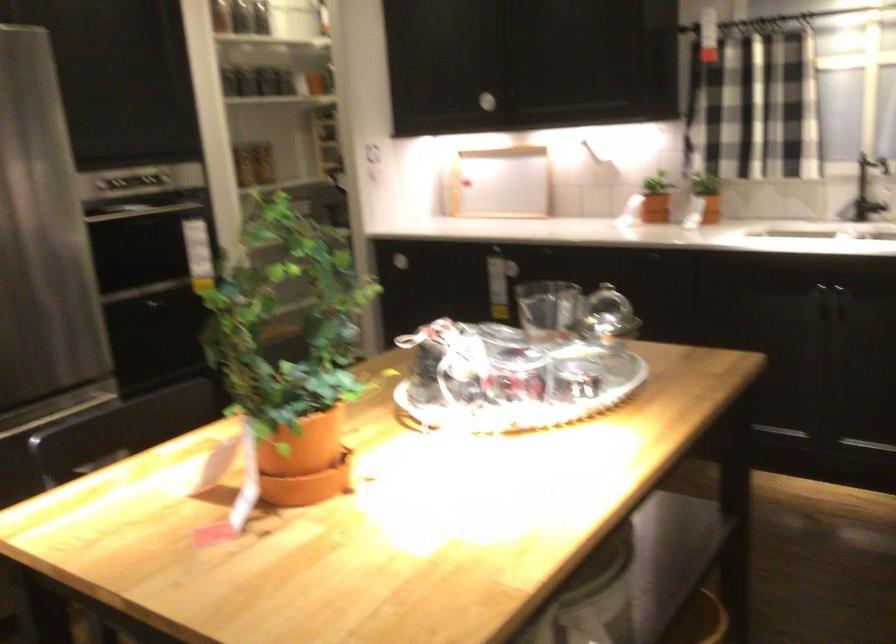
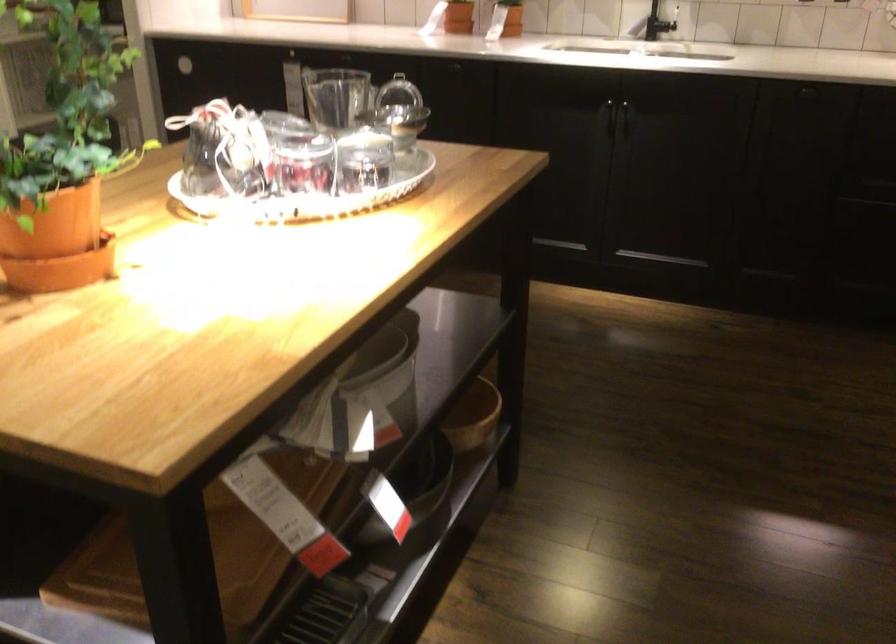
Where in the second image is the point corresponding to point (705, 218) from the first image?

(504, 31)